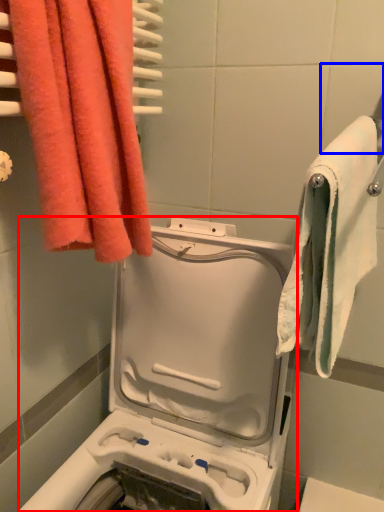
Question: Which object appears farthest to the camera in this image, washing machine (highlighted by a red box) or tile (highlighted by a blue box)?

Choices:
 (A) washing machine
 (B) tile

Answer: (B)